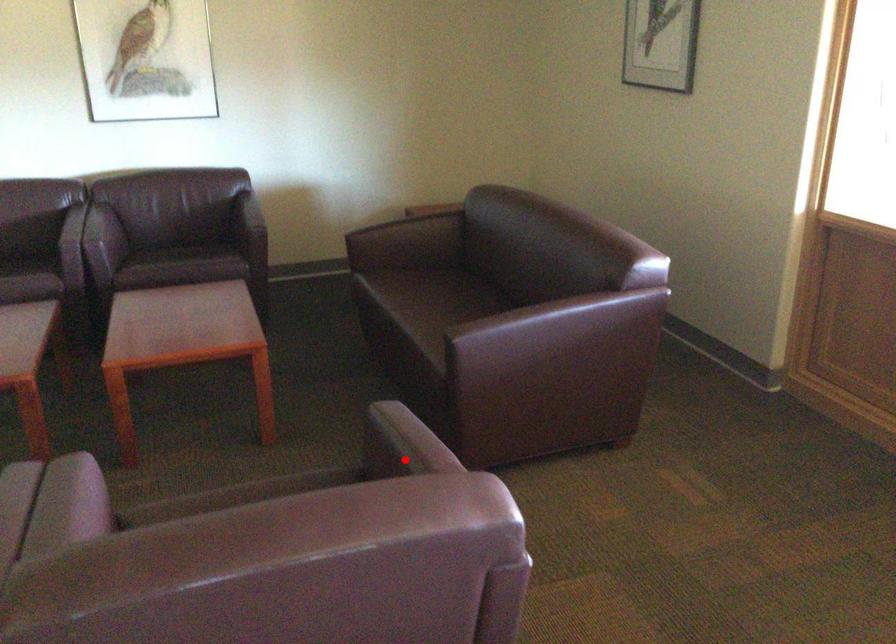
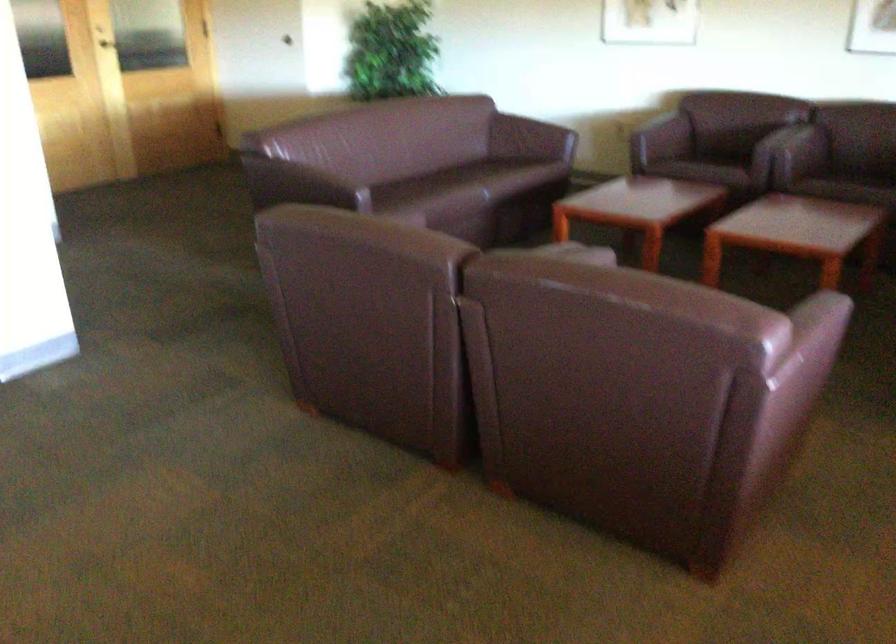
Question: I am providing you with two images of the same scene from different viewpoints. Given a red point in image1, look at the same physical point in image2. Is it:

Choices:
 (A) Closer to the viewpoint
 (B) Farther from the viewpoint

Answer: (B)